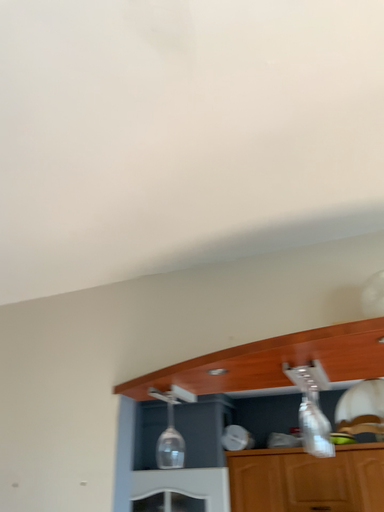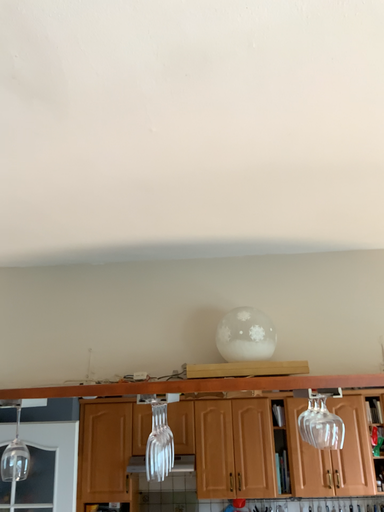
Question: Which way did the camera rotate in the video?

Choices:
 (A) rotated left
 (B) rotated right

Answer: (B)